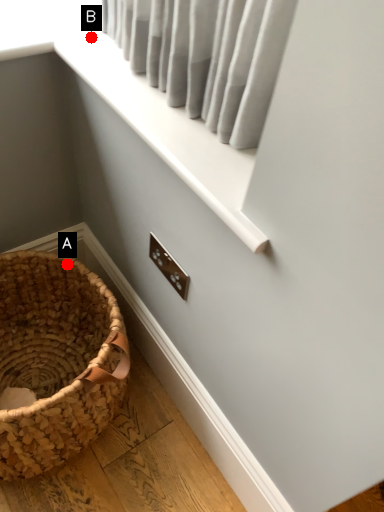
Question: Two points are circled on the image, labeled by A and B beside each circle. Which point is closer to the camera?

Choices:
 (A) A is closer
 (B) B is closer

Answer: (B)